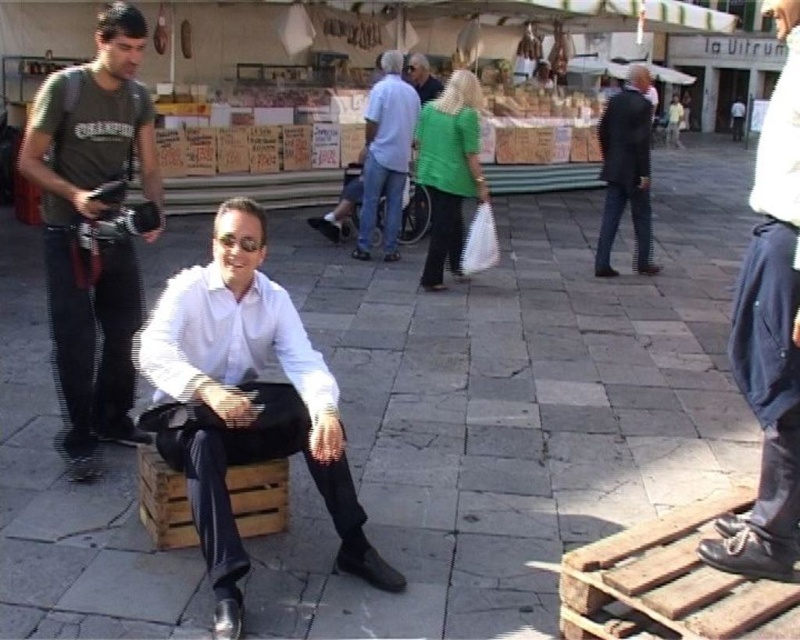
Based on the scene description, where is the dark blue jeans at lower right located in terms of coordinates?

The dark blue jeans at lower right is located at coordinates point [770,333].

You are at the lively outdoor market in a European town square. You see two points marked in the scene. Which point is closer to you, point (330, 429) or point (624, 124)?

Point (330, 429) is closer to you because it is in front of point (624, 124).

You are a fashion designer observing the market scene. You notice the green matte jacket at center and the light blue denim jeans at center. Which clothing item appears bigger in size?

The green matte jacket at center has a larger size compared to the light blue denim jeans at center, so the green matte jacket at center is bigger in size.